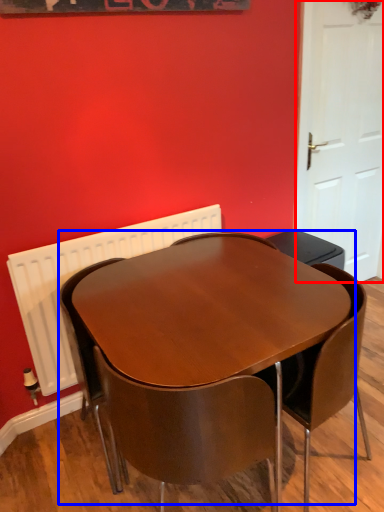
Question: Which of the following is the farthest to the observer, door (highlighted by a red box) or table (highlighted by a blue box)?

Choices:
 (A) door
 (B) table

Answer: (A)